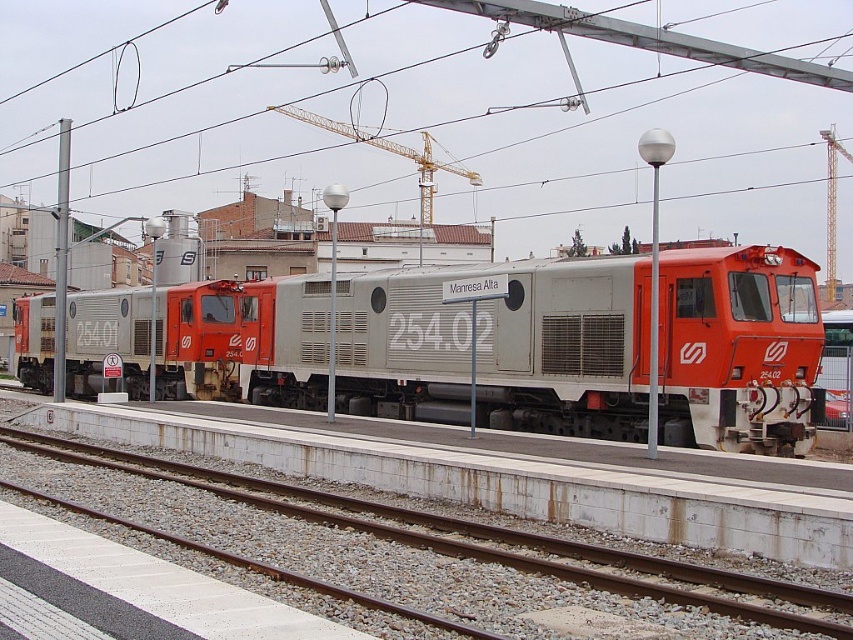
Is matte gray train at center wider than metallic wire at upper center?

No, matte gray train at center is not wider than metallic wire at upper center.

Which is behind, point (752, 310) or point (525, 92)?

The point (525, 92) is more distant.

Which is behind, point (764, 337) or point (239, 58)?

The point (239, 58) is more distant.

At what (x,y) coordinates should I click in order to perform the action: click on matte gray train at center. Please return your answer as a coordinate pair (x, y). This screenshot has width=853, height=640. Looking at the image, I should click on [502, 346].

Which is above, matte gray train at center or gray gravel train track at center?

matte gray train at center

Is point (642, 266) in front of point (809, 593)?

No, (642, 266) is behind (809, 593).

Identify the location of matte gray train at center. The height and width of the screenshot is (640, 853). (502, 346).

Is point (657, 122) farther from viewer compared to point (82, 461)?

Yes.

Which of these two, metallic wire at upper center or gray gravel train track at center, stands shorter?

gray gravel train track at center is shorter.

Which is in front, point (33, 109) or point (498, 531)?

Point (498, 531)

What are the coordinates of `metallic wire at upper center` in the screenshot? It's located at (352, 88).